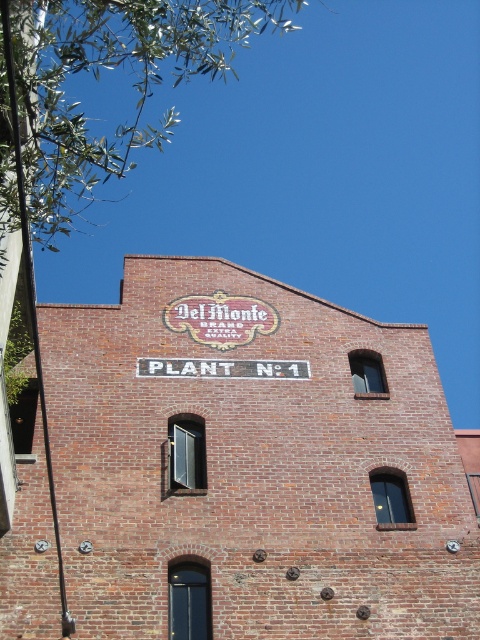
Question: Can you confirm if green leafy branches at upper left is positioned below black painted sign at center?

Choices:
 (A) yes
 (B) no

Answer: (B)

Question: Which point is closer to the camera taking this photo?

Choices:
 (A) (265, 365)
 (B) (192, 60)

Answer: (A)

Question: Can you confirm if green leafy branches at upper left is positioned below black painted sign at center?

Choices:
 (A) no
 (B) yes

Answer: (A)

Question: Among these points, which one is nearest to the camera?

Choices:
 (A) (25, 44)
 (B) (275, 368)

Answer: (A)

Question: Among these points, which one is farthest from the camera?

Choices:
 (A) (60, 177)
 (B) (302, 372)

Answer: (B)

Question: Can you confirm if green leafy branches at upper left is positioned to the right of black painted sign at center?

Choices:
 (A) no
 (B) yes

Answer: (A)